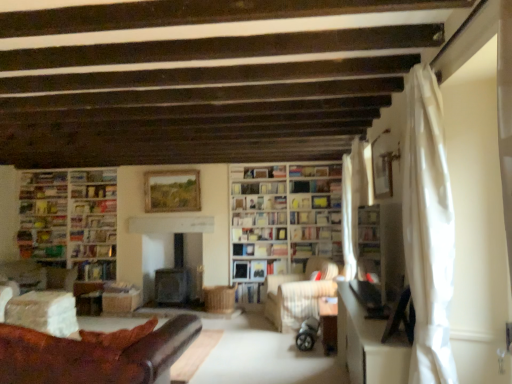
Question: Are hardcover book at center, which is the 5th book from left to right, and wooden picture frame at center located far from each other?

Choices:
 (A) no
 (B) yes

Answer: (B)

Question: Considering the relative sizes of hardcover book at center, which is the 5th book from left to right, and wooden picture frame at center in the image provided, is hardcover book at center, which is the 5th book from left to right, taller than wooden picture frame at center?

Choices:
 (A) yes
 (B) no

Answer: (B)

Question: From the image's perspective, does hardcover book at center, the 3th book from the right, appear higher than wooden picture frame at center?

Choices:
 (A) yes
 (B) no

Answer: (B)

Question: Is hardcover book at center, the 3th book from the right, turned away from wooden picture frame at center?

Choices:
 (A) yes
 (B) no

Answer: (B)

Question: Does hardcover book at center, the 3th book from the right, lie behind wooden picture frame at center?

Choices:
 (A) yes
 (B) no

Answer: (A)

Question: Considering the relative sizes of hardcover book at center, which is the 5th book from left to right, and wooden picture frame at center in the image provided, is hardcover book at center, which is the 5th book from left to right, smaller than wooden picture frame at center?

Choices:
 (A) no
 (B) yes

Answer: (B)

Question: Is hardcover book at left, the 2th book from the left, outside wooden bookshelf at center, placed as the second shelf when sorted from left to right?

Choices:
 (A) no
 (B) yes

Answer: (B)

Question: Is hardcover book at left, the 2th book from the left, turned away from wooden bookshelf at center, placed as the second shelf when sorted from left to right?

Choices:
 (A) no
 (B) yes

Answer: (A)

Question: Is hardcover book at left, the 2th book from the left, to the right of wooden bookshelf at center, positioned as the 3th shelf in bottom-to-top order, from the viewer's perspective?

Choices:
 (A) yes
 (B) no

Answer: (B)

Question: From the image's perspective, does hardcover book at left, the 2th book from the left, appear higher than wooden bookshelf at center, which ranks as the second shelf in front-to-back order?

Choices:
 (A) yes
 (B) no

Answer: (B)

Question: From the image's perspective, is hardcover book at left, the 2th book from the left, located beneath wooden bookshelf at center, the 1th shelf when ordered from top to bottom?

Choices:
 (A) no
 (B) yes

Answer: (B)

Question: Considering the relative positions of hardcover book at left, the 2th book from the left, and wooden bookshelf at center, positioned as the 3th shelf in bottom-to-top order, in the image provided, is hardcover book at left, the 2th book from the left, in front of wooden bookshelf at center, positioned as the 3th shelf in bottom-to-top order,?

Choices:
 (A) no
 (B) yes

Answer: (A)

Question: Is white paper bookshelf at center, the fourth book viewed from the right, bigger than white sheer curtain at right, which appears as the first curtain when viewed from the front?

Choices:
 (A) no
 (B) yes

Answer: (A)